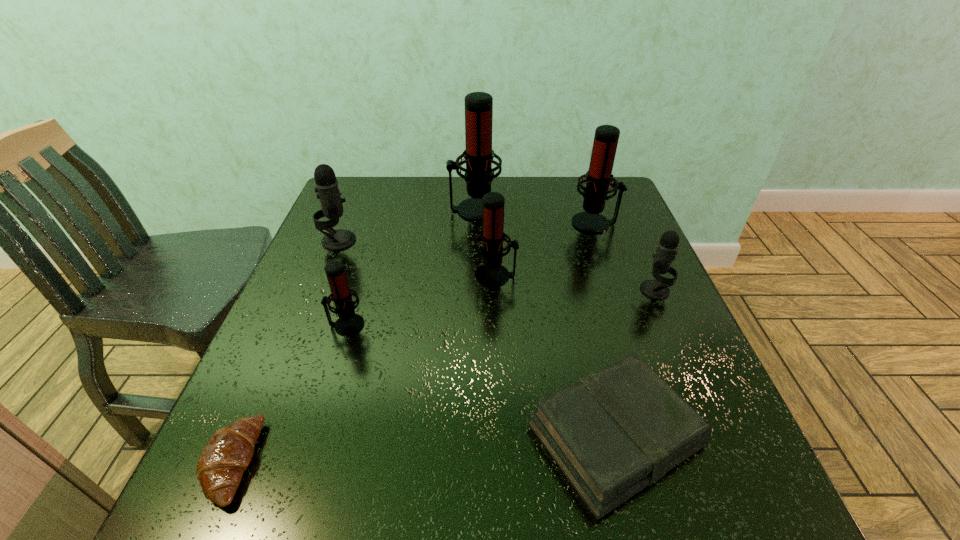
Identify the location of vacant point at the near edge. The height and width of the screenshot is (540, 960). (345, 517).

Locate an element on the screen. free region at the left edge is located at coordinates (324, 367).

This screenshot has width=960, height=540. I want to click on vacant space at the right edge of the desktop, so click(x=648, y=259).

The height and width of the screenshot is (540, 960). In the image, there is a desktop. Find the location of `blank space at the far left corner`. blank space at the far left corner is located at coordinates (363, 198).

Locate an element on the screen. The height and width of the screenshot is (540, 960). vacant space at the near right corner is located at coordinates (786, 531).

In order to click on free spot between the third smallest red microphone and the tallest object in this screenshot , I will do pos(535,217).

This screenshot has height=540, width=960. I want to click on free space between the bigger black microphone and the tallest microphone, so click(406, 225).

This screenshot has height=540, width=960. I want to click on vacant space that's between the third biggest red microphone and the leftmost red microphone, so click(421, 300).

Locate an element on the screen. Image resolution: width=960 pixels, height=540 pixels. vacant point located between the fifth shortest microphone and the third farthest red microphone is located at coordinates (545, 249).

Identify the location of vacant area between the crescent roll and the nearer black microphone. (444, 376).